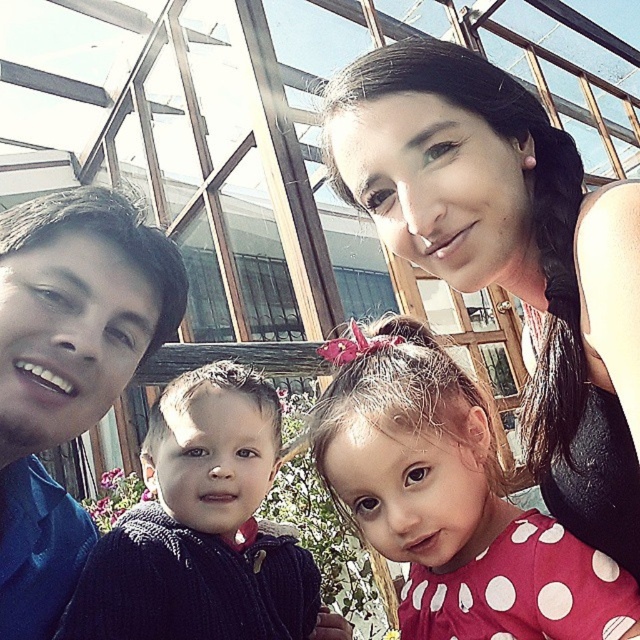
What do you see at coordinates (509, 253) in the screenshot? Image resolution: width=640 pixels, height=640 pixels. I see `matte black hair at upper center` at bounding box center [509, 253].

Based on the photo, between matte black hair at upper center and blue shirt at left, which one appears on the right side from the viewer's perspective?

matte black hair at upper center is more to the right.

Identify the location of matte black hair at upper center. (509, 253).

Does white polka dot dress at center come in front of dark blue corduroy sweater at left?

That is True.

I want to click on white polka dot dress at center, so click(x=451, y=500).

Does white polka dot dress at center appear on the left side of blue shirt at left?

No, white polka dot dress at center is not to the left of blue shirt at left.

Does white polka dot dress at center appear under blue shirt at left?

Yes, white polka dot dress at center is below blue shirt at left.

Is point (451, 627) behind point (76, 508)?

No, it is not.

What are the coordinates of `white polka dot dress at center` in the screenshot? It's located at (451, 500).